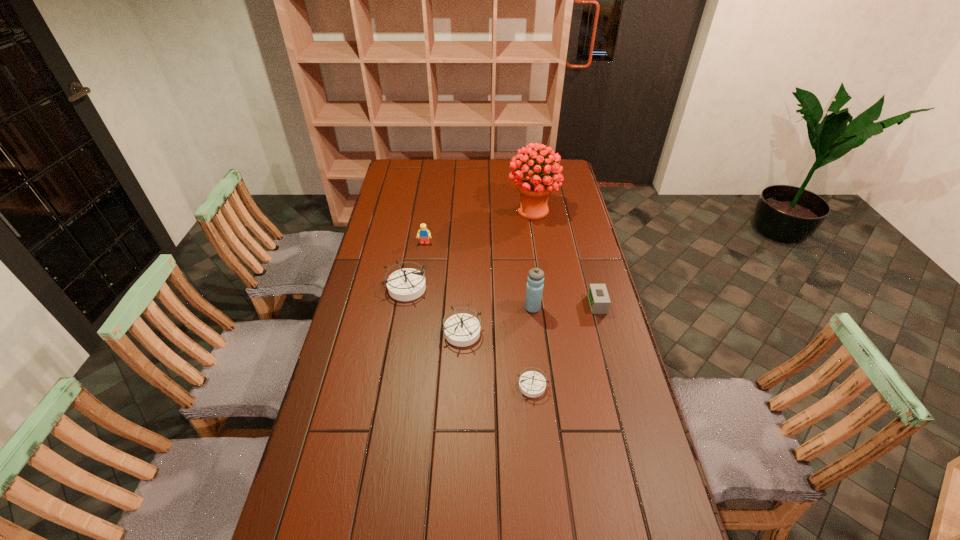
In the current image, all compasss are evenly spaced. To maintain this equal spacing, where should an additional compass be placed on the right? Please point out a free spot. Please provide its 2D coordinates. Your answer should be formatted as a tuple, i.e. [(x, y)], where the tuple contains the x and y coordinates of a point satisfying the conditions above.

[(620, 453)]